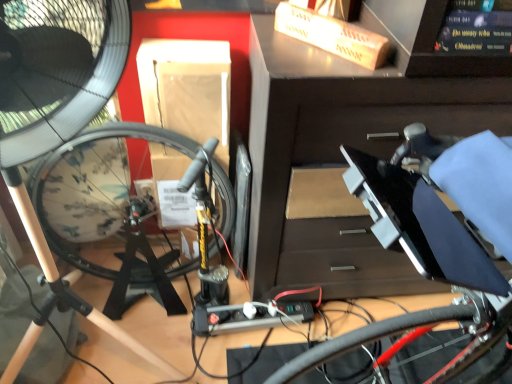
Question: Is shiny red bicycle wheel at lower right surrounding black plastic workbench at center?

Choices:
 (A) no
 (B) yes

Answer: (A)

Question: Is shiny red bicycle wheel at lower right facing towards black plastic workbench at center?

Choices:
 (A) yes
 (B) no

Answer: (B)

Question: Does shiny red bicycle wheel at lower right have a lesser height compared to black plastic workbench at center?

Choices:
 (A) yes
 (B) no

Answer: (A)

Question: Does shiny red bicycle wheel at lower right touch black plastic workbench at center?

Choices:
 (A) yes
 (B) no

Answer: (B)

Question: Is shiny red bicycle wheel at lower right far from black plastic workbench at center?

Choices:
 (A) yes
 (B) no

Answer: (B)

Question: Would you say black glossy book at upper right is inside or outside shiny red bicycle wheel at lower right?

Choices:
 (A) inside
 (B) outside

Answer: (B)

Question: In terms of height, does black glossy book at upper right look taller or shorter compared to shiny red bicycle wheel at lower right?

Choices:
 (A) short
 (B) tall

Answer: (B)

Question: Considering the positions of black glossy book at upper right and shiny red bicycle wheel at lower right in the image, is black glossy book at upper right bigger or smaller than shiny red bicycle wheel at lower right?

Choices:
 (A) small
 (B) big

Answer: (A)

Question: From a real-world perspective, relative to shiny red bicycle wheel at lower right, is black glossy book at upper right vertically above or below?

Choices:
 (A) above
 (B) below

Answer: (A)

Question: Does point (311, 61) appear closer or farther from the camera than point (74, 71)?

Choices:
 (A) closer
 (B) farther

Answer: (B)

Question: Is black plastic workbench at center spatially inside black matte fan at left, or outside of it?

Choices:
 (A) outside
 (B) inside

Answer: (A)

Question: From their relative heights in the image, would you say black plastic workbench at center is taller or shorter than black matte fan at left?

Choices:
 (A) short
 (B) tall

Answer: (B)

Question: Is black plastic workbench at center in front of or behind black matte fan at left in the image?

Choices:
 (A) behind
 (B) front

Answer: (B)

Question: Is black plastic workbench at center bigger or smaller than shiny red bicycle wheel at lower right?

Choices:
 (A) small
 (B) big

Answer: (B)

Question: Is black plastic workbench at center in front of or behind shiny red bicycle wheel at lower right in the image?

Choices:
 (A) behind
 (B) front

Answer: (B)